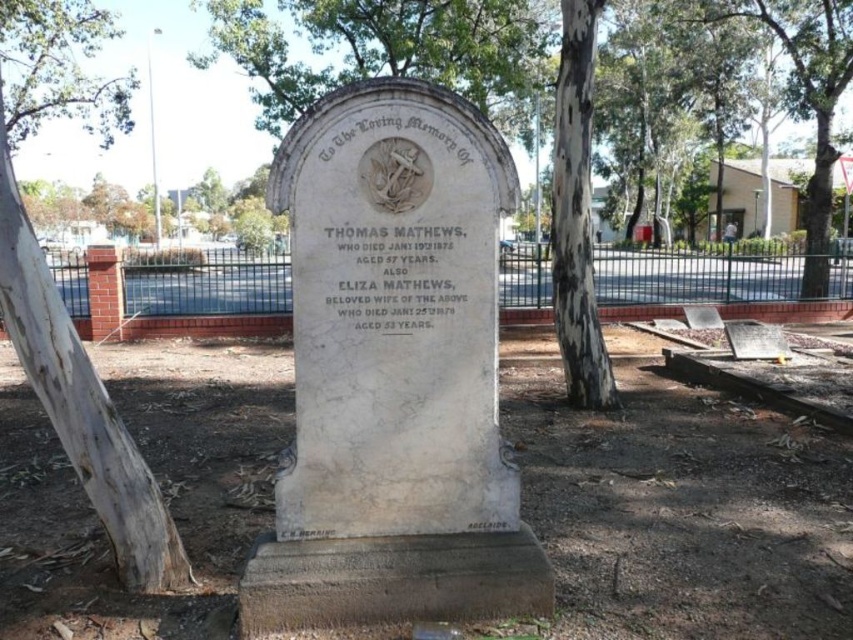
Is green leafy tree at upper center below white bark tree at center?

Actually, green leafy tree at upper center is above white bark tree at center.

Is green leafy tree at upper center above white bark tree at center?

Yes.

Image resolution: width=853 pixels, height=640 pixels. In order to click on green leafy tree at upper center in this screenshot , I will do `click(386, 49)`.

Find the location of a particular element. The image size is (853, 640). white marble gravestone at center is located at coordinates (393, 371).

Measure the distance between point (354, 177) and camera.

They are 2.69 meters apart.

At what (x,y) coordinates should I click in order to perform the action: click on white marble gravestone at center. Please return your answer as a coordinate pair (x, y). Image resolution: width=853 pixels, height=640 pixels. Looking at the image, I should click on (393, 371).

Does white bark tree at center have a larger size compared to white bark tree at upper center?

No.

Does point (573, 248) come in front of point (209, 236)?

Yes, point (573, 248) is closer to viewer.

The image size is (853, 640). Find the location of `white bark tree at center`. white bark tree at center is located at coordinates (576, 216).